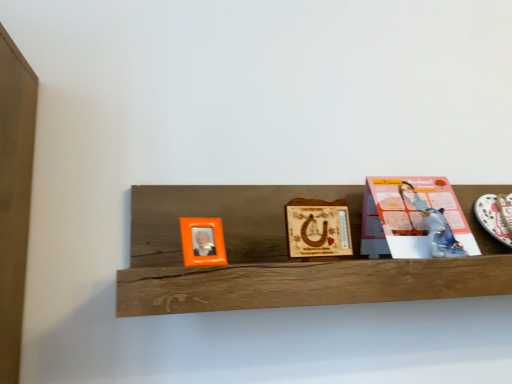
Question: Should I look upward or downward to see orange plastic picture frame at left, which appears as the first picture frame when viewed from the left?

Choices:
 (A) up
 (B) down

Answer: (B)

Question: From the image's perspective, is wooden plaque with horseshoe at center, marked as the second picture frame in a left-to-right arrangement, located beneath pink paper at right?

Choices:
 (A) no
 (B) yes

Answer: (B)

Question: Is wooden plaque with horseshoe at center, which is the 1th picture frame from right to left, taller than pink paper at right?

Choices:
 (A) yes
 (B) no

Answer: (B)

Question: Is wooden plaque with horseshoe at center, which is the 1th picture frame from right to left, not inside pink paper at right?

Choices:
 (A) yes
 (B) no

Answer: (A)

Question: Is wooden plaque with horseshoe at center, which is the 1th picture frame from right to left, positioned in front of pink paper at right?

Choices:
 (A) no
 (B) yes

Answer: (B)

Question: Can you confirm if wooden plaque with horseshoe at center, marked as the second picture frame in a left-to-right arrangement, is bigger than pink paper at right?

Choices:
 (A) yes
 (B) no

Answer: (B)

Question: From a real-world perspective, is wooden plaque with horseshoe at center, which is the 1th picture frame from right to left, on pink paper at right?

Choices:
 (A) yes
 (B) no

Answer: (B)

Question: Is orange plastic picture frame at left, which is the second picture frame from right to left, located outside white glossy platter at right?

Choices:
 (A) yes
 (B) no

Answer: (A)

Question: From the image's perspective, does orange plastic picture frame at left, which is the second picture frame from right to left, appear higher than white glossy platter at right?

Choices:
 (A) yes
 (B) no

Answer: (B)

Question: Is orange plastic picture frame at left, which is the second picture frame from right to left, taller than white glossy platter at right?

Choices:
 (A) yes
 (B) no

Answer: (B)

Question: Is orange plastic picture frame at left, which appears as the first picture frame when viewed from the left, facing away from white glossy platter at right?

Choices:
 (A) no
 (B) yes

Answer: (A)

Question: Is orange plastic picture frame at left, which is the second picture frame from right to left, wider than white glossy platter at right?

Choices:
 (A) no
 (B) yes

Answer: (A)

Question: Is orange plastic picture frame at left, which is the second picture frame from right to left, behind white glossy platter at right?

Choices:
 (A) no
 (B) yes

Answer: (A)

Question: From the image's perspective, does orange plastic picture frame at left, which is the second picture frame from right to left, appear lower than wooden plaque with horseshoe at center, marked as the second picture frame in a left-to-right arrangement?

Choices:
 (A) no
 (B) yes

Answer: (B)